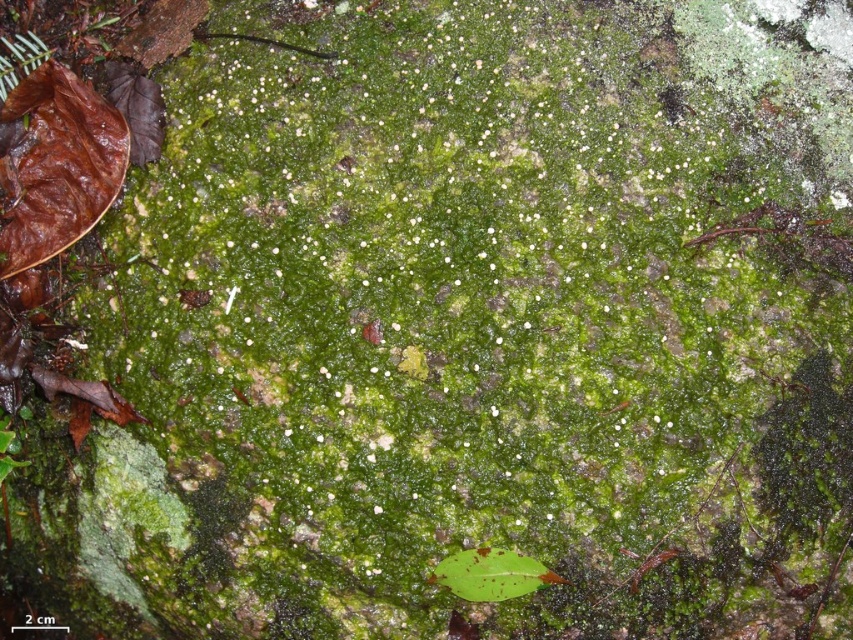
Can you confirm if brown matte leaf at lower left is thinner than green matte leaf at lower center?

No, brown matte leaf at lower left is not thinner than green matte leaf at lower center.

Find the location of a particular element. The height and width of the screenshot is (640, 853). brown matte leaf at lower left is located at coordinates (56, 164).